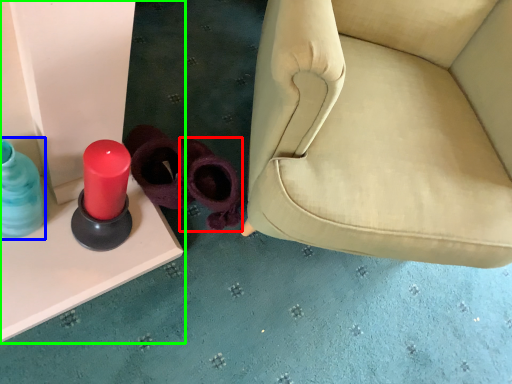
Question: Estimate the real-world distances between objects in this image. Which object is farther from footwear (highlighted by a red box), bottle (highlighted by a blue box) or furniture (highlighted by a green box)?

Choices:
 (A) bottle
 (B) furniture

Answer: (A)